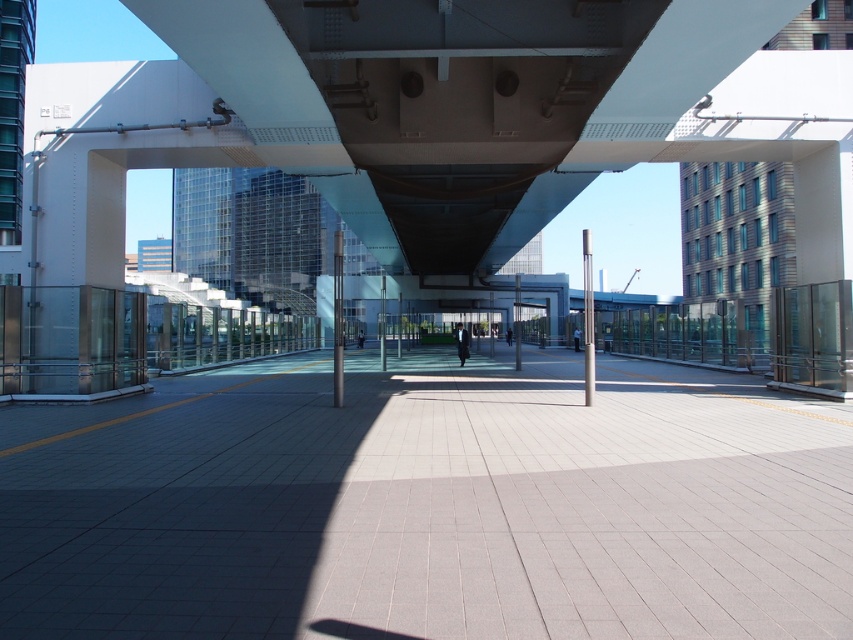
Question: Among these points, which one is nearest to the camera?

Choices:
 (A) (585, 634)
 (B) (784, 132)

Answer: (A)

Question: Can you confirm if light gray concrete pavement at center is bigger than white glossy pedestrian bridge at center?

Choices:
 (A) no
 (B) yes

Answer: (A)

Question: Where is light gray concrete pavement at center located in relation to white glossy pedestrian bridge at center in the image?

Choices:
 (A) left
 (B) right

Answer: (A)

Question: Which object is farther from the camera taking this photo?

Choices:
 (A) white glossy pedestrian bridge at center
 (B) light gray concrete pavement at center

Answer: (A)

Question: Does light gray concrete pavement at center appear over white glossy pedestrian bridge at center?

Choices:
 (A) yes
 (B) no

Answer: (B)